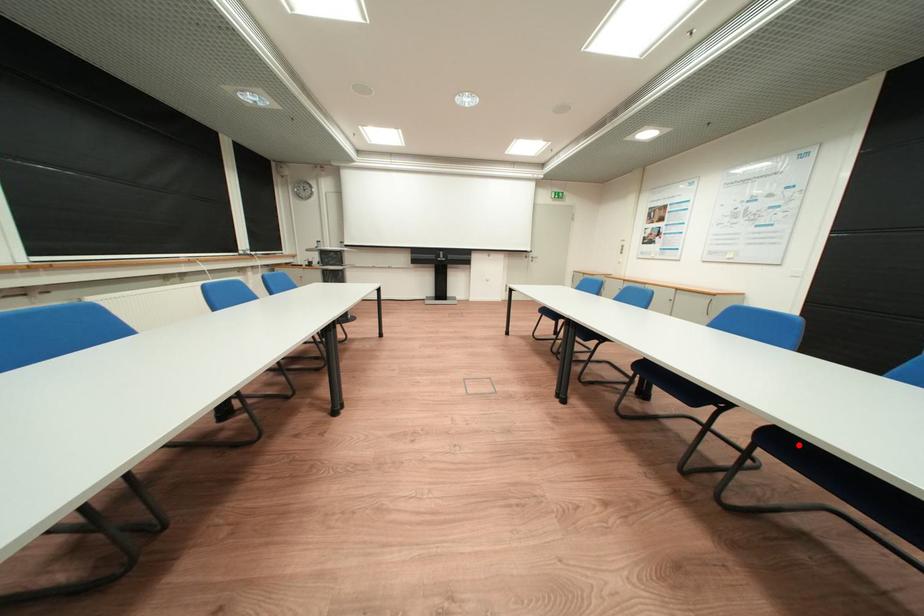
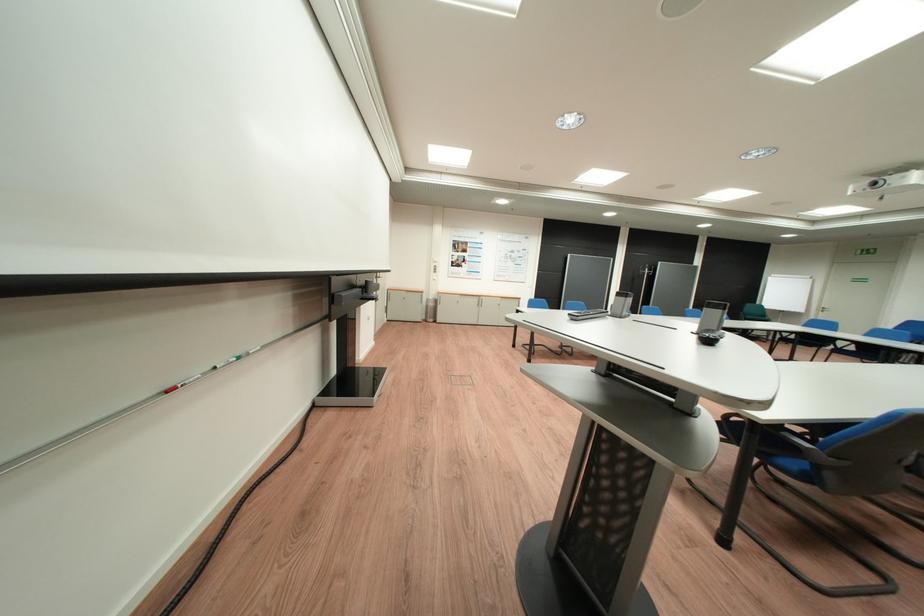
Question: I am providing you with two images of the same scene from different viewpoints. A red point is marked on the first image. Is the red point's position out of view in image 2?

Choices:
 (A) Yes
 (B) No

Answer: (A)